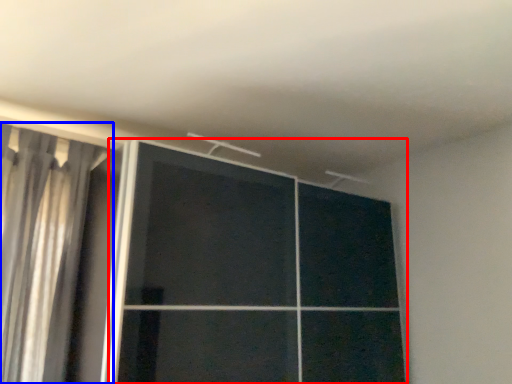
Question: Which object is further to the camera taking this photo, door (highlighted by a red box) or curtain (highlighted by a blue box)?

Choices:
 (A) door
 (B) curtain

Answer: (B)